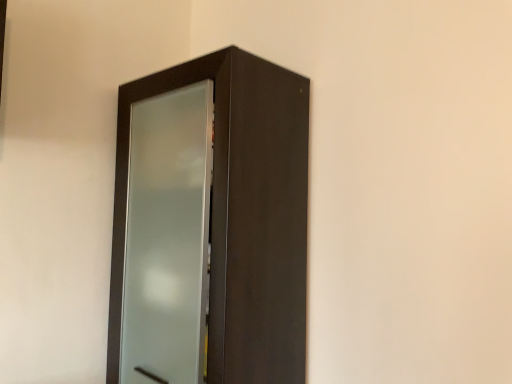
At what (x,y) coordinates should I click in order to perform the action: click on satin wood door at center. Please return your answer as a coordinate pair (x, y). This screenshot has height=384, width=512. Looking at the image, I should click on (210, 225).

Describe the element at coordinates (210, 225) in the screenshot. I see `satin wood door at center` at that location.

This screenshot has width=512, height=384. Find the location of `satin wood door at center`. satin wood door at center is located at coordinates (210, 225).